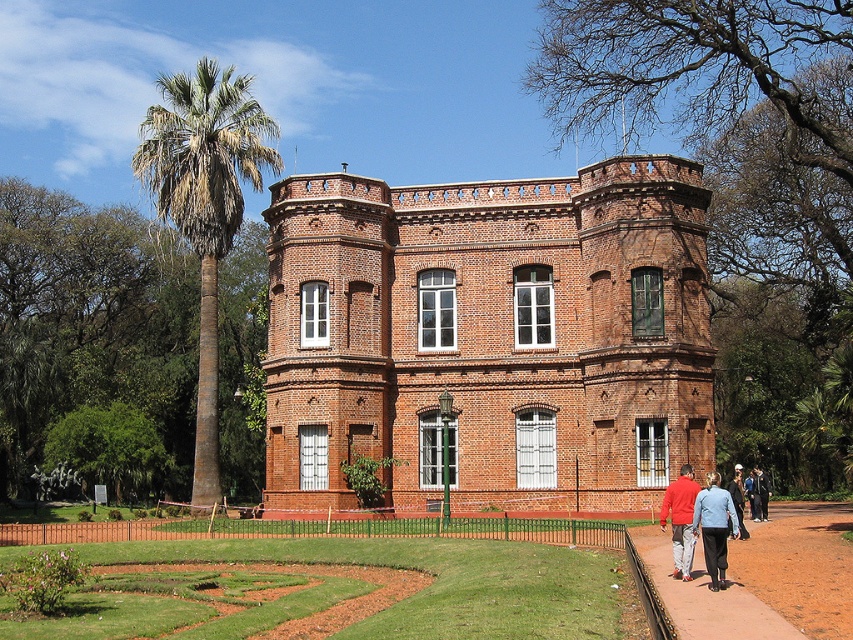
Consider the image. Can you confirm if brown dirt path at lower right is bigger than dark blue jeans at lower right?

Yes, brown dirt path at lower right is bigger than dark blue jeans at lower right.

At what (x,y) coordinates should I click in order to perform the action: click on brown dirt path at lower right. Please return your answer as a coordinate pair (x, y). This screenshot has height=640, width=853. Looking at the image, I should click on (764, 577).

Locate an element on the screen. This screenshot has width=853, height=640. brown dirt path at lower right is located at coordinates (764, 577).

Looking at this image, can you confirm if green leafy palm at left is smaller than blue denim jacket at lower right?

No.

Does green leafy palm at left have a greater height compared to blue denim jacket at lower right?

Yes.

This screenshot has width=853, height=640. What do you see at coordinates (206, 204) in the screenshot?
I see `green leafy palm at left` at bounding box center [206, 204].

Where is `green leafy palm at left`? Image resolution: width=853 pixels, height=640 pixels. green leafy palm at left is located at coordinates (206, 204).

The image size is (853, 640). Describe the element at coordinates (759, 493) in the screenshot. I see `blue denim jacket at center` at that location.

Is blue denim jacket at center shorter than dark blue jeans at lower right?

Yes, blue denim jacket at center is shorter than dark blue jeans at lower right.

Does point (755, 483) come behind point (741, 538)?

Yes, point (755, 483) is farther from viewer.

Locate an element on the screen. blue denim jacket at center is located at coordinates (759, 493).